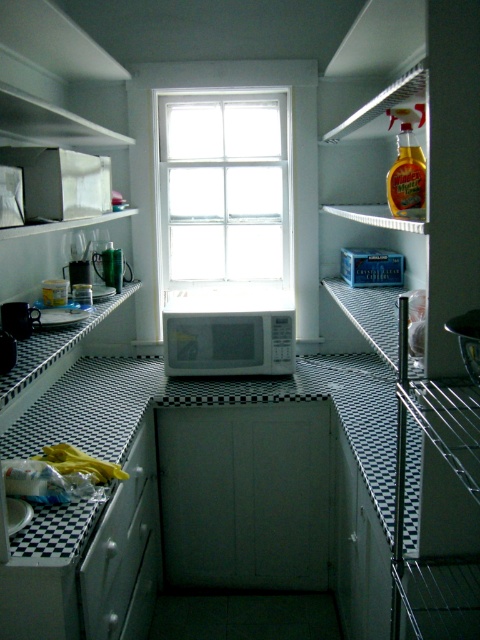
Between white matte microwave at center and white matte exhaust hood at upper center, which one appears on the right side from the viewer's perspective?

white matte exhaust hood at upper center is more to the right.

Can you confirm if white matte microwave at center is positioned below white matte exhaust hood at upper center?

Yes, white matte microwave at center is below white matte exhaust hood at upper center.

Who is more distant from viewer, (229,374) or (414,4)?

The point (229,374) is more distant.

Locate an element on the screen. white matte microwave at center is located at coordinates (228, 342).

Who is more distant from viewer, [345,625] or [223,330]?

Positioned behind is point [223,330].

Does metallic silver fridge at right lie in front of white matte microwave at center?

Yes.

Measure the distance between metallic silver fridge at right and camera.

metallic silver fridge at right is 84.20 centimeters away from camera.

Find the location of a particular element. metallic silver fridge at right is located at coordinates (419, 323).

Which is below, white glass window at center or white matte exhaust hood at upper center?

white glass window at center

Can you confirm if white glass window at center is positioned above white matte exhaust hood at upper center?

Actually, white glass window at center is below white matte exhaust hood at upper center.

Describe the element at coordinates (224, 189) in the screenshot. I see `white glass window at center` at that location.

Locate an element on the screen. white glass window at center is located at coordinates (224, 189).